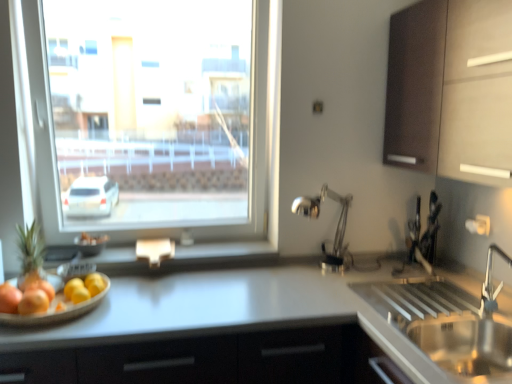
Where is `empty space that is ontop of smooth wooden tray at lower left, which is the 2th fruit in right-to-left order (from a real-world perspective)`? The height and width of the screenshot is (384, 512). empty space that is ontop of smooth wooden tray at lower left, which is the 2th fruit in right-to-left order (from a real-world perspective) is located at coordinates click(56, 290).